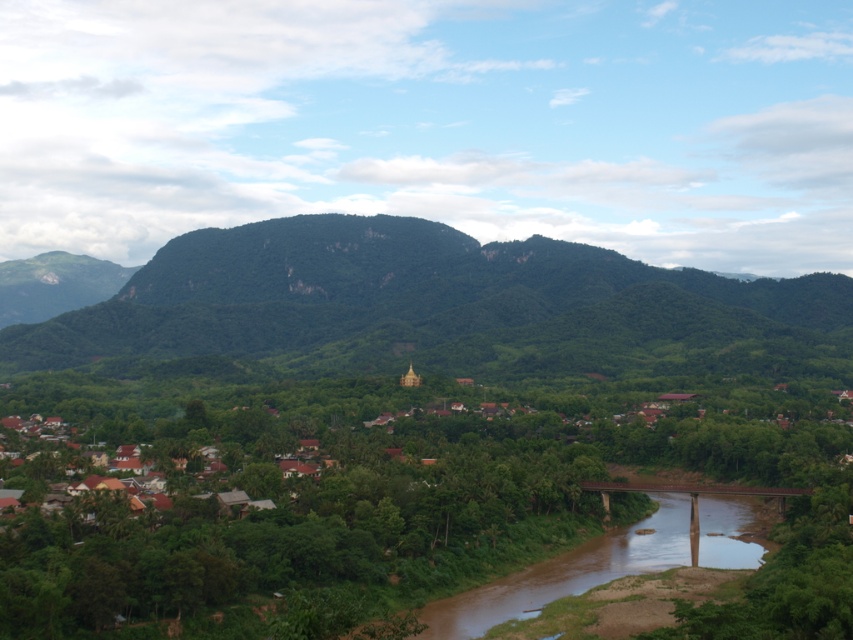
You are planning to build a hiking trail that goes from the green forested mountain at center to the brown muddy water at center. Considering their relative heights, which object will require more effort to ascend when moving from one to the other?

The green forested mountain at center has a greater height compared to the brown muddy water at center, so ascending the green forested mountain at center will require more effort.

You are standing at the point closer to the camera between the two points, point (50, 356) and point (440, 627). Which point are you standing at?

You are standing at point (50, 356) because it is further to the camera than point (440, 627).